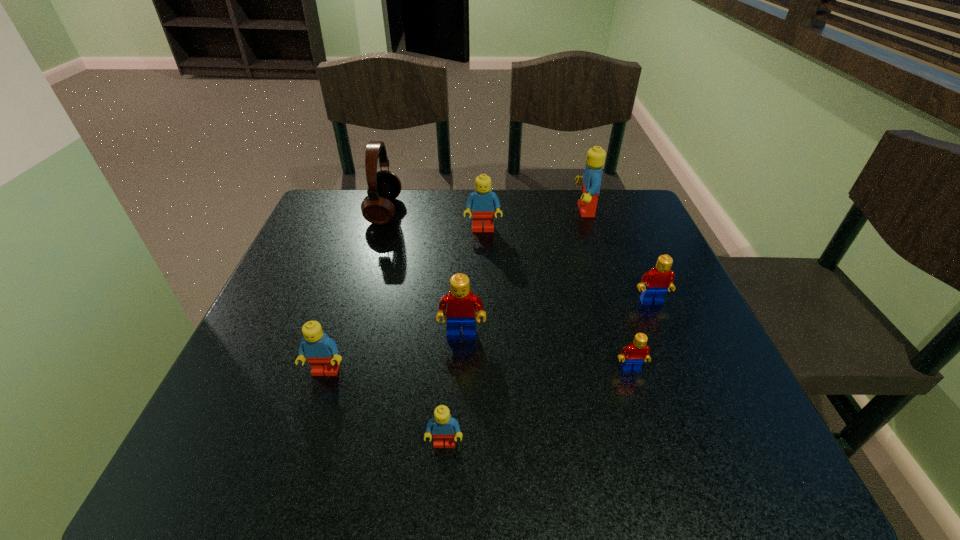
What are the coordinates of `free spot located on the front-facing side of the second farthest red Lego` in the screenshot? It's located at (458, 427).

In order to click on vacant space located on the face of the leftmost Lego in this screenshot , I will do `click(294, 469)`.

I want to click on free region located 0.190m on the front-facing side of the fifth nearest Lego, so click(685, 382).

Image resolution: width=960 pixels, height=540 pixels. I want to click on free spot located on the front-facing side of the nearest red Lego, so click(x=652, y=436).

Locate an element on the screen. The width and height of the screenshot is (960, 540). headset that is at the far edge is located at coordinates (384, 186).

This screenshot has height=540, width=960. I want to click on object located at the near edge, so click(443, 426).

Where is `headset that is at the left edge`? This screenshot has width=960, height=540. headset that is at the left edge is located at coordinates (384, 186).

This screenshot has width=960, height=540. I want to click on Lego that is at the left edge, so click(x=321, y=351).

Where is `object present at the far left corner`? object present at the far left corner is located at coordinates (384, 186).

What are the coordinates of `object present at the far right corner` in the screenshot? It's located at (591, 180).